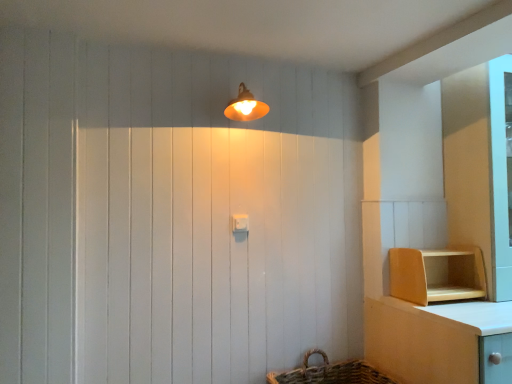
Question: Considering the relative sizes of wooden shelf at lower right and white plastic light switch at center in the image provided, is wooden shelf at lower right taller than white plastic light switch at center?

Choices:
 (A) no
 (B) yes

Answer: (B)

Question: Is the depth of wooden shelf at lower right greater than that of white plastic light switch at center?

Choices:
 (A) yes
 (B) no

Answer: (B)

Question: Can you confirm if wooden shelf at lower right is thinner than white plastic light switch at center?

Choices:
 (A) yes
 (B) no

Answer: (B)

Question: Does wooden shelf at lower right have a smaller size compared to white plastic light switch at center?

Choices:
 (A) yes
 (B) no

Answer: (B)

Question: Is wooden shelf at lower right positioned in front of white plastic light switch at center?

Choices:
 (A) no
 (B) yes

Answer: (B)

Question: From the image's perspective, would you say wooden shelf at lower right is positioned over white plastic light switch at center?

Choices:
 (A) yes
 (B) no

Answer: (B)

Question: Is white plastic light switch at center touching wooden shelf at lower right?

Choices:
 (A) yes
 (B) no

Answer: (B)

Question: Would you say white plastic light switch at center is outside wooden shelf at lower right?

Choices:
 (A) no
 (B) yes

Answer: (B)

Question: Is white plastic light switch at center far from wooden shelf at lower right?

Choices:
 (A) yes
 (B) no

Answer: (B)

Question: From a real-world perspective, is white plastic light switch at center physically below wooden shelf at lower right?

Choices:
 (A) no
 (B) yes

Answer: (A)

Question: Considering the relative sizes of white plastic light switch at center and wooden shelf at lower right in the image provided, is white plastic light switch at center shorter than wooden shelf at lower right?

Choices:
 (A) no
 (B) yes

Answer: (B)

Question: Does white plastic light switch at center have a lesser width compared to wooden shelf at lower right?

Choices:
 (A) no
 (B) yes

Answer: (B)

Question: From a real-world perspective, is matte orange lampshade at upper center below white plastic light switch at center?

Choices:
 (A) yes
 (B) no

Answer: (B)